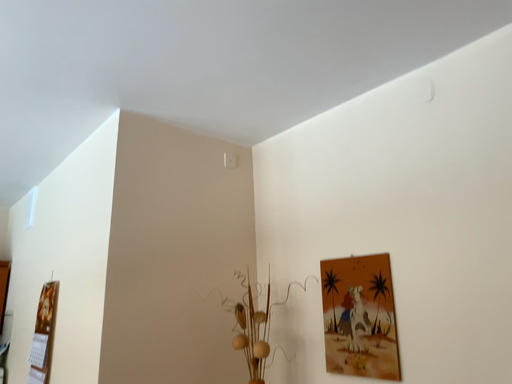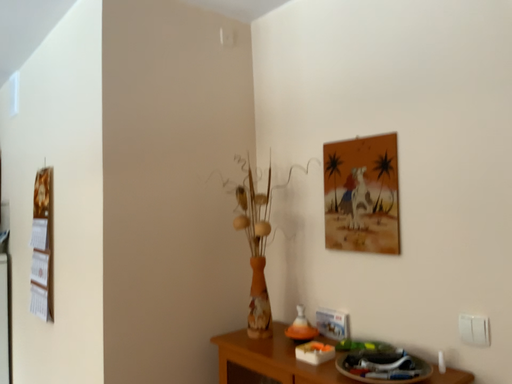
Question: Which way did the camera rotate in the video?

Choices:
 (A) rotated downward
 (B) rotated upward

Answer: (A)